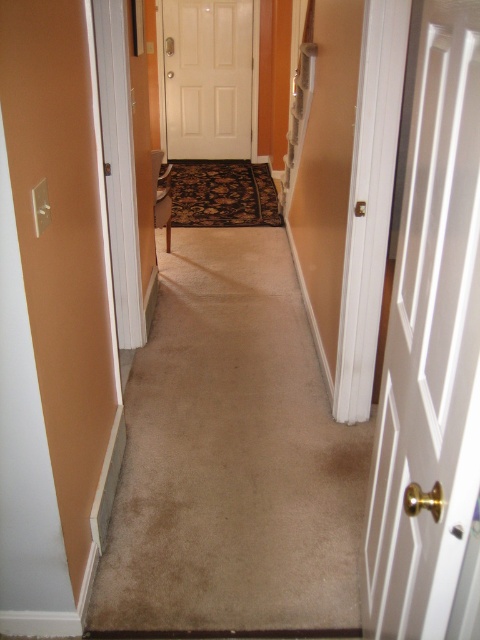
Question: Is white wood door at right thinner than white matte door at center?

Choices:
 (A) no
 (B) yes

Answer: (B)

Question: Among these objects, which one is farthest from the camera?

Choices:
 (A) white matte door at center
 (B) white wood door at right

Answer: (A)

Question: Which point is closer to the camera?

Choices:
 (A) (197, 8)
 (B) (377, 534)

Answer: (B)

Question: Can you confirm if white wood door at right is thinner than white matte door at center?

Choices:
 (A) yes
 (B) no

Answer: (A)

Question: Can you confirm if white wood door at right is positioned to the left of white matte door at center?

Choices:
 (A) no
 (B) yes

Answer: (A)